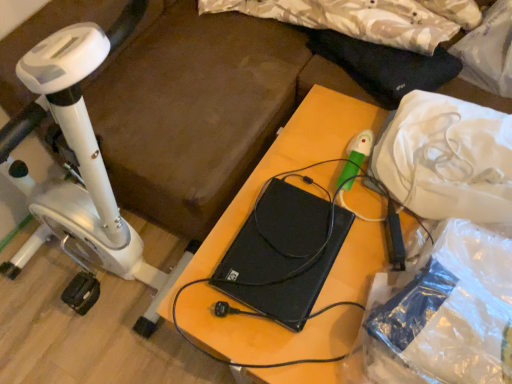
Question: Is black matte laptop at center smaller than white plastic bag at upper right?

Choices:
 (A) yes
 (B) no

Answer: (A)

Question: From a real-world perspective, is black matte laptop at center on white plastic bag at upper right?

Choices:
 (A) no
 (B) yes

Answer: (A)

Question: Is black matte laptop at center behind white plastic bag at upper right?

Choices:
 (A) yes
 (B) no

Answer: (A)

Question: Can you confirm if black matte laptop at center is wider than white plastic bag at upper right?

Choices:
 (A) yes
 (B) no

Answer: (B)

Question: Is black matte laptop at center oriented away from white plastic bag at upper right?

Choices:
 (A) no
 (B) yes

Answer: (A)

Question: From a real-world perspective, does black matte laptop at center sit lower than white plastic bag at upper right?

Choices:
 (A) yes
 (B) no

Answer: (A)

Question: Is white plastic stationary bicycle at left outside of black matte laptop at center?

Choices:
 (A) yes
 (B) no

Answer: (A)

Question: From the image's perspective, does white plastic stationary bicycle at left appear lower than black matte laptop at center?

Choices:
 (A) no
 (B) yes

Answer: (A)

Question: Could black matte laptop at center be considered to be inside white plastic stationary bicycle at left?

Choices:
 (A) yes
 (B) no

Answer: (B)

Question: Is white plastic stationary bicycle at left turned away from black matte laptop at center?

Choices:
 (A) no
 (B) yes

Answer: (A)

Question: Is the depth of white plastic stationary bicycle at left less than that of black matte laptop at center?

Choices:
 (A) no
 (B) yes

Answer: (B)

Question: Is white plastic stationary bicycle at left aimed at black matte laptop at center?

Choices:
 (A) no
 (B) yes

Answer: (B)

Question: From the image's perspective, is white plastic stationary bicycle at left below black matte laptop at center?

Choices:
 (A) no
 (B) yes

Answer: (A)